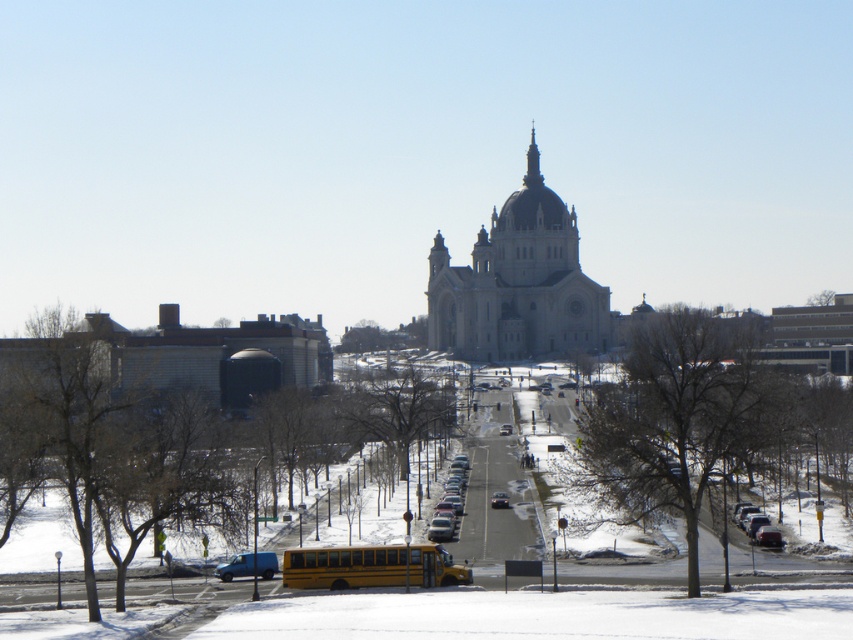
You are standing at the cathedral and want to walk to the yellow school bus parked on the left side of the street. Which point, point [376,564] or point [462,465], is closer to the cathedral?

Point [376,564] is closer to the cathedral because it is in front of point [462,465].

You are standing on the street in front of the cathedral and notice two points marked on the snow. The first point is at coordinates point (393, 560) and the second is at point (263, 561). Which point is closer to you?

Point (393, 560) is closer to the viewer than point (263, 561).

You are a photographer planning to take a picture of the white stone church at center and the matte black car at center. Given that the church is larger, which object should you focus on first to ensure both are in frame without moving the camera?

The white stone church at center is bigger than the matte black car at center, so you should focus on the white stone church at center first to ensure it fits within the frame before adjusting for the smaller matte black car at center.